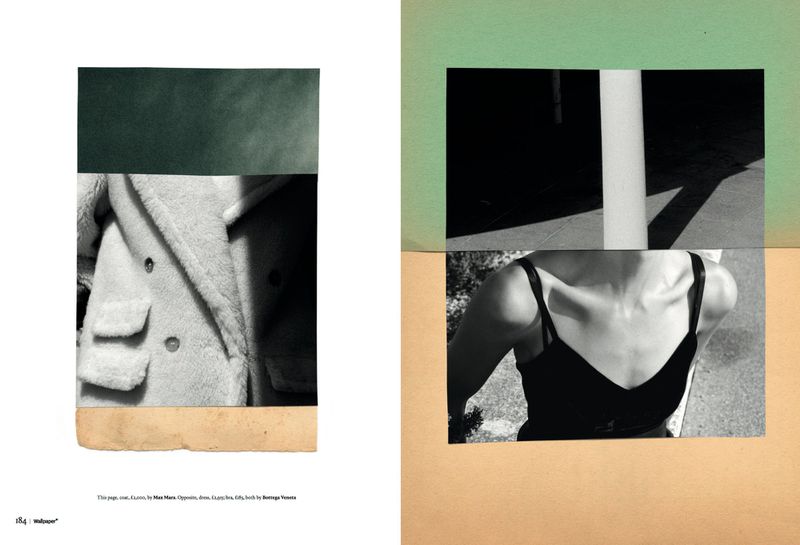
The image size is (800, 545). In order to click on chest in this screenshot , I will do `click(632, 339)`.